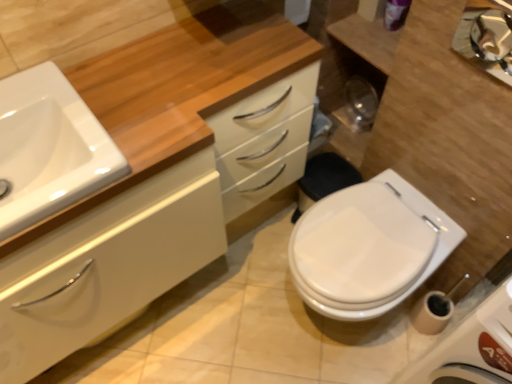
The height and width of the screenshot is (384, 512). I want to click on vacant space situated above white glossy cabinet at center (from a real-world perspective), so click(163, 94).